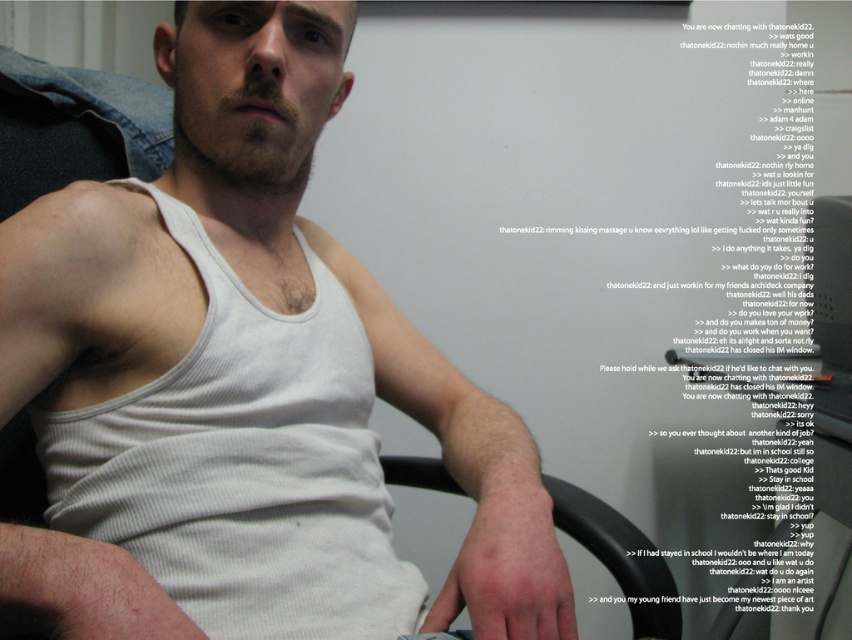
Is point (219, 28) positioned in front of point (612, 528)?

Yes, it is.

Between point (16, 369) and point (643, 556), which one is positioned behind?

The point (643, 556) is behind.

Locate an element on the screen. This screenshot has width=852, height=640. white ribbed tank top at center is located at coordinates (350, 282).